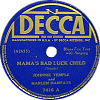
Where is `cd`? cd is located at coordinates (53, 6).